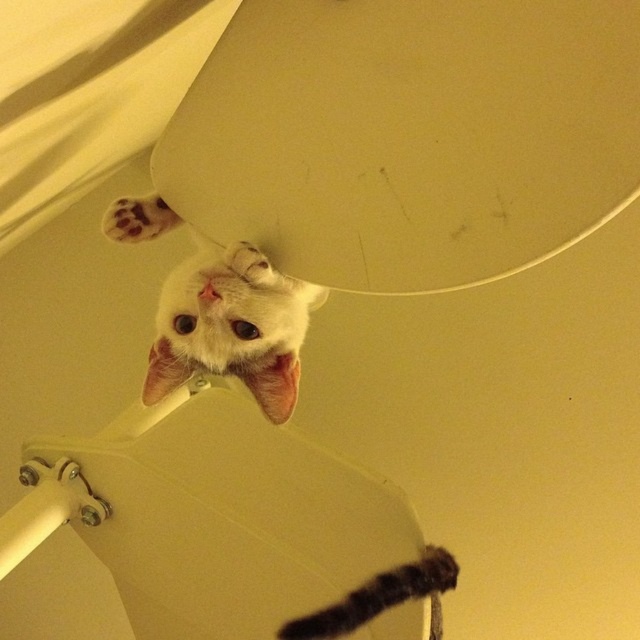
You are a photographer trying to capture the white fur cat at upper center and the white fur paw at upper left in a single frame. Based on their sizes, which one would appear larger in the photo?

The white fur cat at upper center would appear much larger in the photo since it is much taller than the white fur paw at upper left.

In the image, there is a white fur cat at upper center and a white fur paw at upper left. Which object takes up more space in the image?

The white fur cat at upper center takes up more space in the image because it has a larger size compared to the white fur paw at upper left.

Looking at the scene, which object is wider between the white fur cat at upper center and the white fur paw at upper left?

The white fur cat at upper center is wider than the white fur paw at upper left.